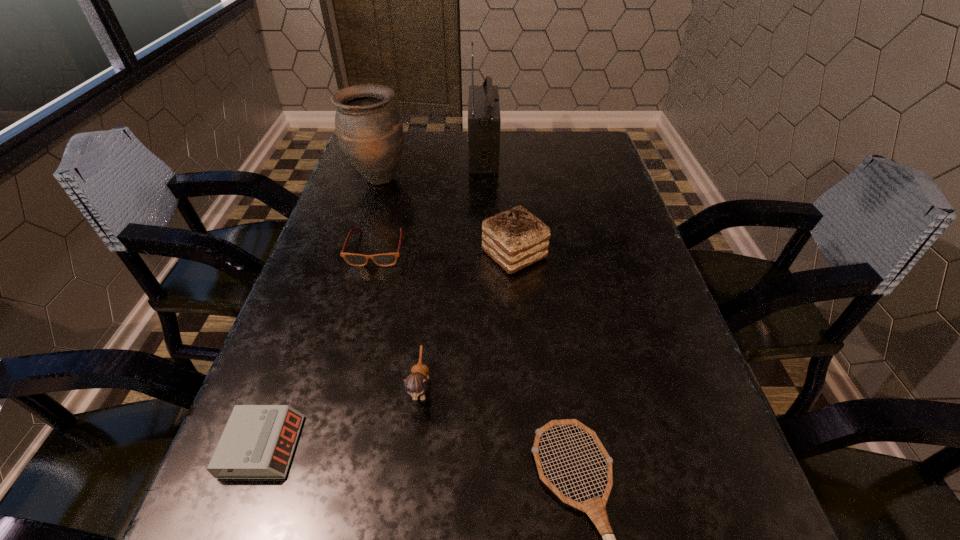
Find the location of a particular element. The width and height of the screenshot is (960, 540). blank space located on the back of the urn is located at coordinates click(x=387, y=151).

Where is `free space located 0.080m on the back of the fifth shortest object`? This screenshot has width=960, height=540. free space located 0.080m on the back of the fifth shortest object is located at coordinates (511, 214).

This screenshot has height=540, width=960. What are the coordinates of `free space located 0.150m on the front-facing side of the fourth shortest object` in the screenshot? It's located at (406, 516).

Find the location of a particular element. The height and width of the screenshot is (540, 960). free space located 0.380m on the front-facing side of the spectacles is located at coordinates (329, 433).

Identify the location of free spot located 0.230m on the back of the alarm clock. The height and width of the screenshot is (540, 960). (313, 310).

Where is `radio receiver that is at the far edge`? The height and width of the screenshot is (540, 960). radio receiver that is at the far edge is located at coordinates (484, 120).

Image resolution: width=960 pixels, height=540 pixels. Identify the location of urn that is at the far edge. (369, 129).

Find the location of a particular element. This screenshot has width=960, height=540. urn situated at the left edge is located at coordinates (369, 129).

Locate an element on the screen. The height and width of the screenshot is (540, 960). spectacles positioned at the left edge is located at coordinates pyautogui.click(x=387, y=259).

Where is `alarm clock present at the left edge`? alarm clock present at the left edge is located at coordinates (258, 441).